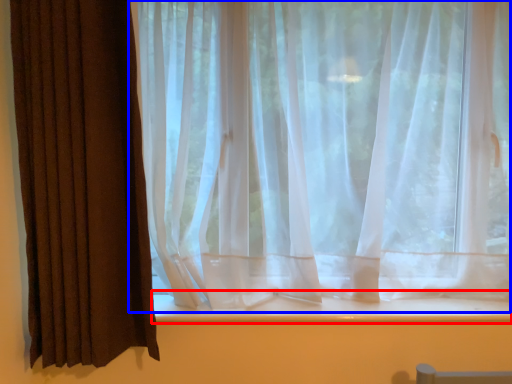
Question: Which of the following is the farthest to the observer, window sill (highlighted by a red box) or curtain (highlighted by a blue box)?

Choices:
 (A) window sill
 (B) curtain

Answer: (A)